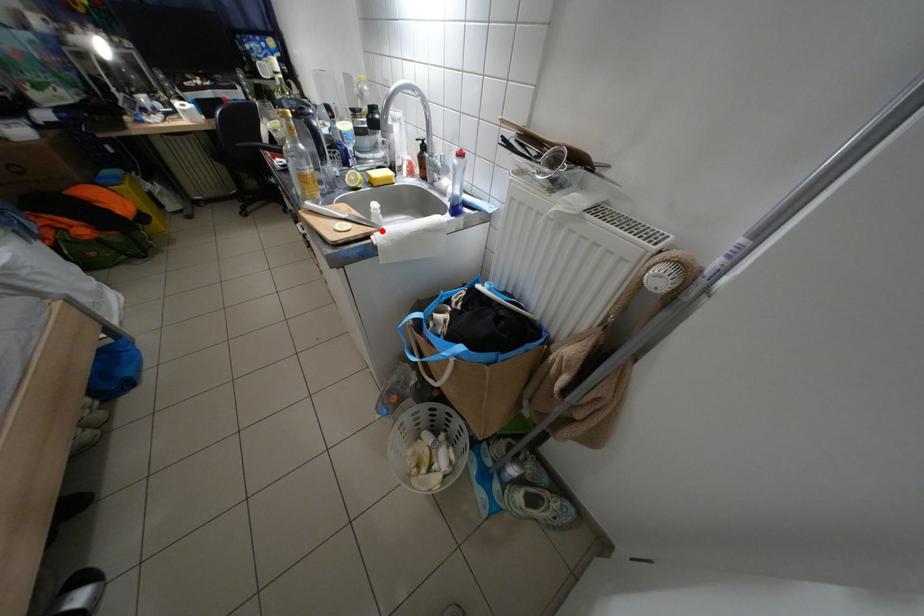
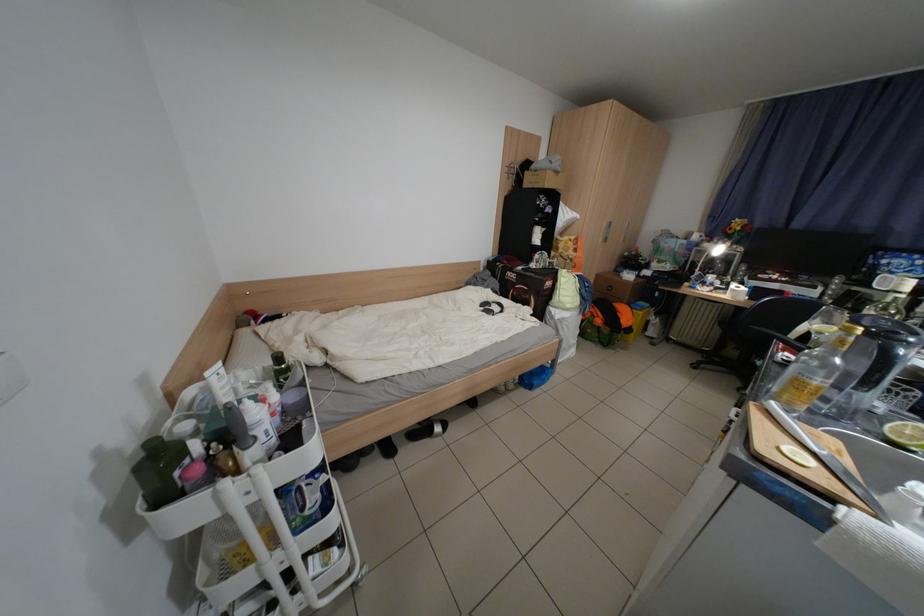
Find the pixel in the second image that matches the highlighted location in the first image.

(864, 500)